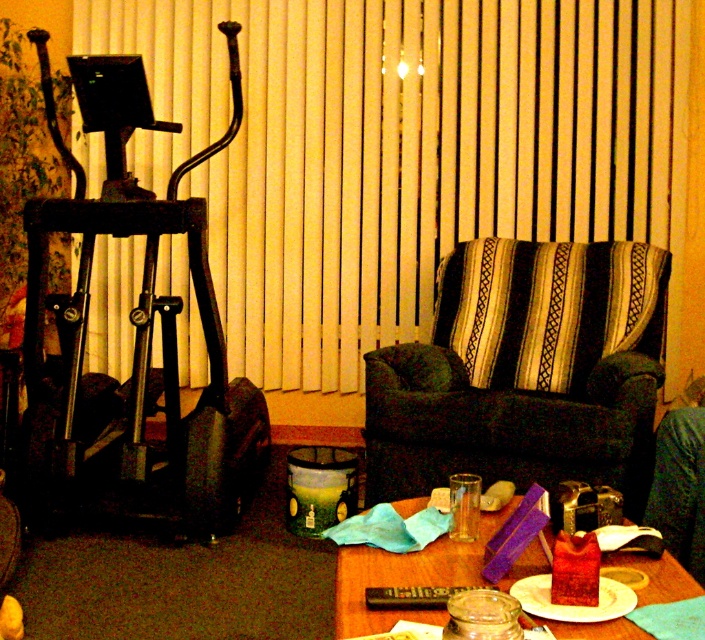
This screenshot has width=705, height=640. Describe the element at coordinates (522, 371) in the screenshot. I see `dark green fabric armchair at center` at that location.

Does point (525, 372) come farther from viewer compared to point (32, 378)?

Yes, point (525, 372) is behind point (32, 378).

Is point (639, 358) positioned behind point (128, 60)?

Yes, it is behind point (128, 60).

In order to click on dark green fabric armchair at center in this screenshot , I will do `click(522, 371)`.

Between yellow fabric blind at upper center and dark green fabric armchair at center, which one appears on the left side from the viewer's perspective?

yellow fabric blind at upper center

Is yellow fabric blind at upper center smaller than dark green fabric armchair at center?

No.

You are a GUI agent. You are given a task and a screenshot of the screen. Output one action in this format:
    pyautogui.click(x=<x>, y=<y>)
    Task: Click on the yellow fabric blind at upper center
    
    Given the screenshot: What is the action you would take?
    pyautogui.click(x=403, y=150)

The width and height of the screenshot is (705, 640). What are the coordinates of `dark green fabric armchair at center` in the screenshot? It's located at (522, 371).

Is point (484, 275) positioned before point (400, 566)?

No.

Between point (632, 429) and point (337, 634), which one is positioned behind?

The point (632, 429) is behind.

In order to click on dark green fabric armchair at center in this screenshot , I will do `click(522, 371)`.